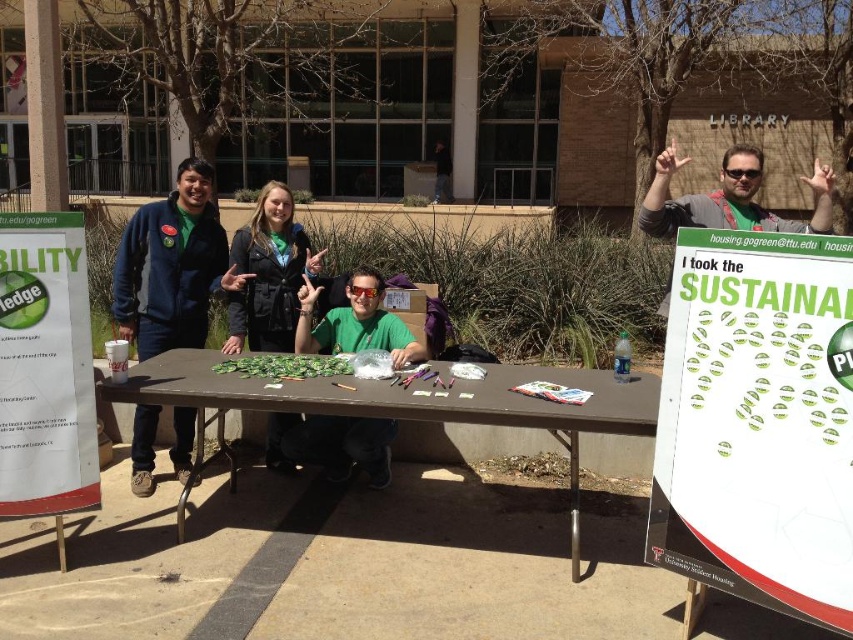
You are a photographer trying to capture a clear photo of the green matte shirt at center without the dark blue fleece jacket at left blocking it. Can you adjust your position to do so?

The dark blue fleece jacket at left is positioned over the green matte shirt at center, so moving your camera position slightly to the right or left might allow you to capture the green matte shirt at center without obstruction.

You are standing at the center of the image and want to know what is located at the coordinate point (171, 266). What is it?

The point (171, 266) corresponds to the dark blue fleece jacket at left.